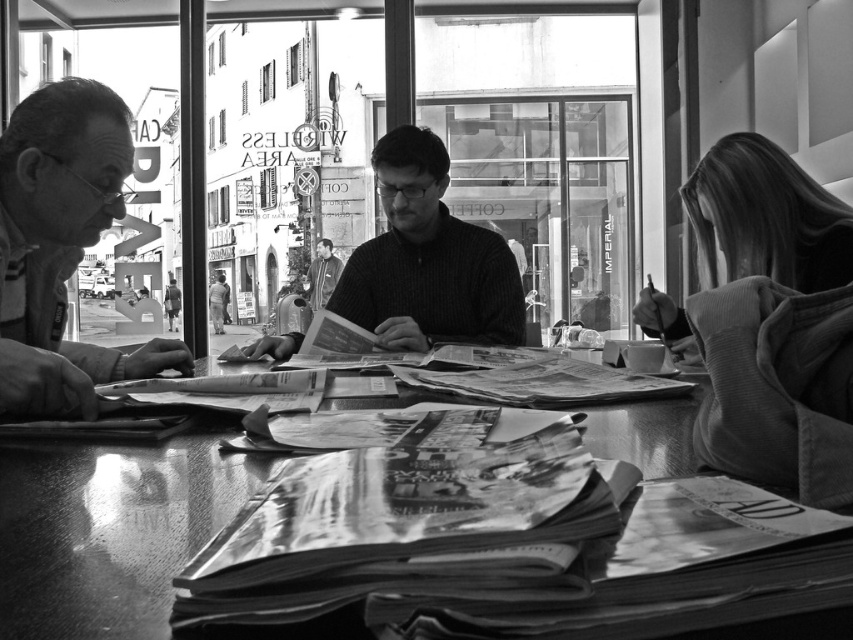
The width and height of the screenshot is (853, 640). Describe the element at coordinates (767, 317) in the screenshot. I see `soft corduroy jacket at right` at that location.

Which is below, soft corduroy jacket at right or smooth gray jacket at center?

soft corduroy jacket at right is below.

Who is more forward, (833, 429) or (323, 266)?

Point (833, 429) is more forward.

You are a GUI agent. You are given a task and a screenshot of the screen. Output one action in this format:
    pyautogui.click(x=<x>, y=<y>)
    Task: Click on the soft corduroy jacket at right
    The height and width of the screenshot is (640, 853).
    Given the screenshot: What is the action you would take?
    pyautogui.click(x=767, y=317)

Between smooth wooden table at center and matte black glasses at left, which one is positioned lower?

smooth wooden table at center

Does smooth wooden table at center have a smaller size compared to matte black glasses at left?

Indeed, smooth wooden table at center has a smaller size compared to matte black glasses at left.

This screenshot has height=640, width=853. What do you see at coordinates (109, 531) in the screenshot?
I see `smooth wooden table at center` at bounding box center [109, 531].

The height and width of the screenshot is (640, 853). I want to click on smooth wooden table at center, so click(109, 531).

Is soft corduroy jacket at right to the left of knitted sweater at center from the viewer's perspective?

No, soft corduroy jacket at right is not to the left of knitted sweater at center.

Is point (775, 371) closer to viewer compared to point (479, 289)?

Yes, point (775, 371) is in front of point (479, 289).

Locate an element on the screen. soft corduroy jacket at right is located at coordinates (767, 317).